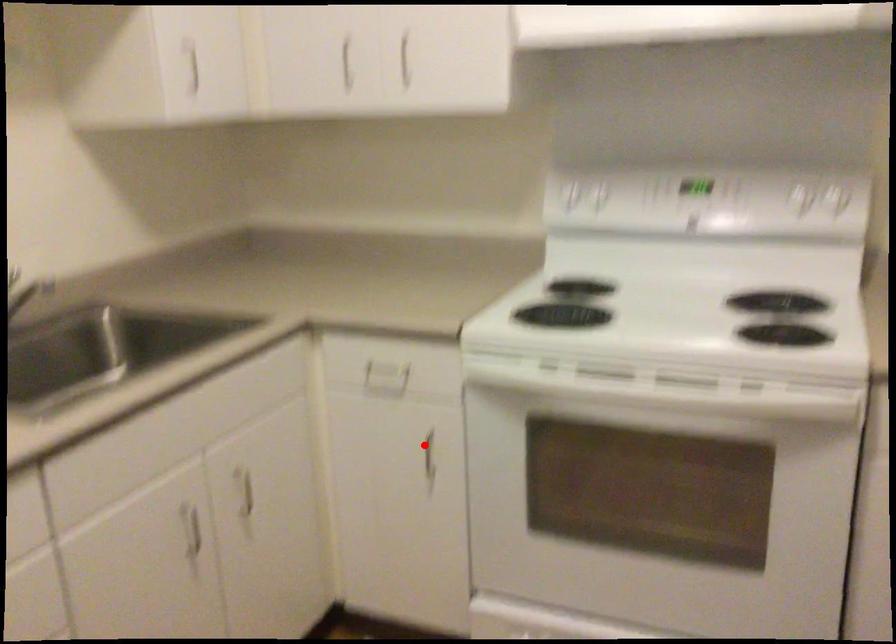
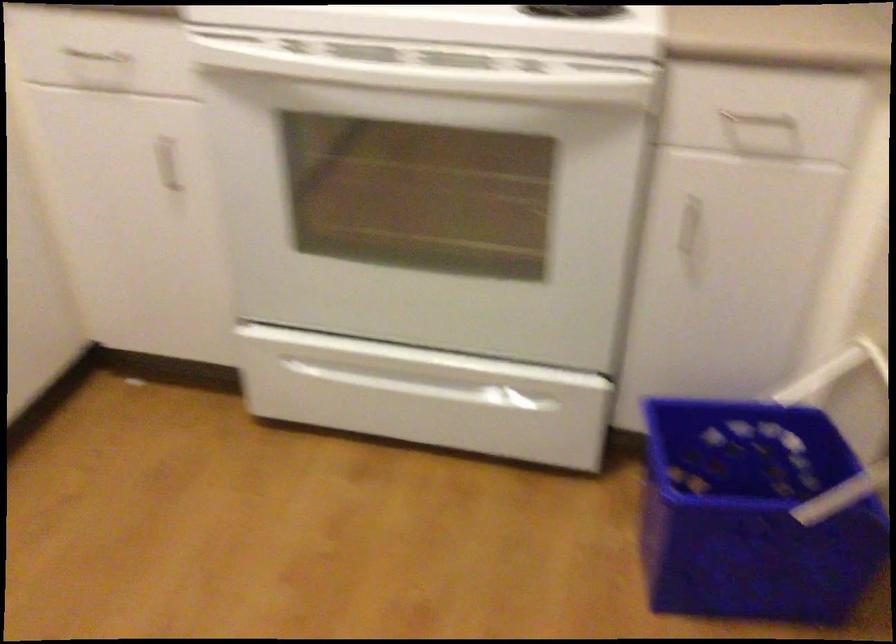
The point at the highlighted location is marked in the first image. Where is the corresponding point in the second image?

(167, 164)